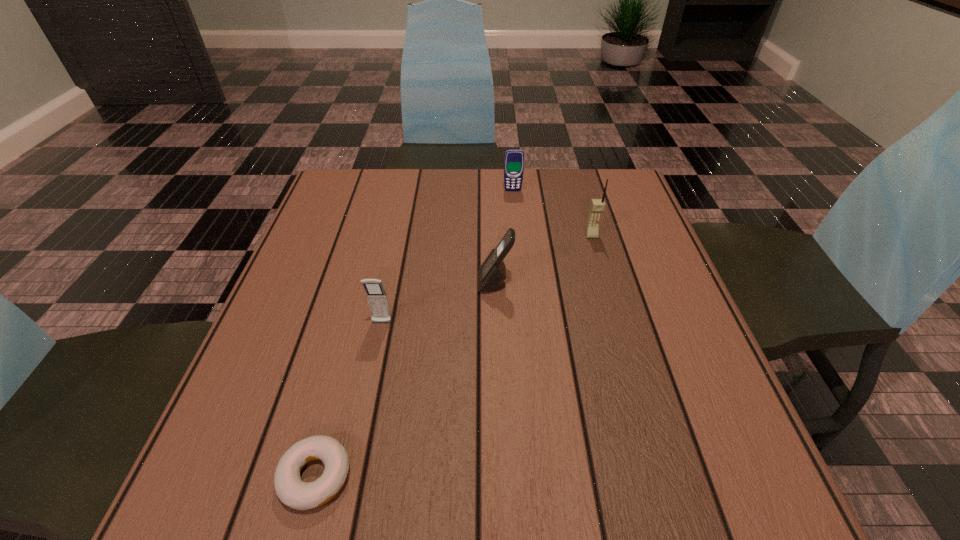
Identify the location of the rightmost cellular telephone. (597, 206).

Find the location of a particular element. Image resolution: width=960 pixels, height=540 pixels. the fourth nearest object is located at coordinates point(597,206).

You are a GUI agent. You are given a task and a screenshot of the screen. Output one action in this format:
    pyautogui.click(x=<x>, y=<y>)
    Task: Click on the third nearest object
    This screenshot has width=960, height=540.
    Given the screenshot: What is the action you would take?
    (x=492, y=273)

Identify the location of the nearest cellular telephone. Image resolution: width=960 pixels, height=540 pixels. (376, 295).

The width and height of the screenshot is (960, 540). Identify the location of the fourth farthest object. (376, 295).

Find the location of `the farthest object`. the farthest object is located at coordinates (514, 158).

This screenshot has width=960, height=540. What are the coordinates of `doughnut` in the screenshot? It's located at (291, 490).

I want to click on the nearest object, so click(x=291, y=490).

What are the coordinates of `vacant space situated on the front of the rightmost cellular telephone, where the keypad is located` in the screenshot? It's located at (601, 270).

Identify the location of vacant space located on the front-facing side of the third nearest object. The width and height of the screenshot is (960, 540). (441, 283).